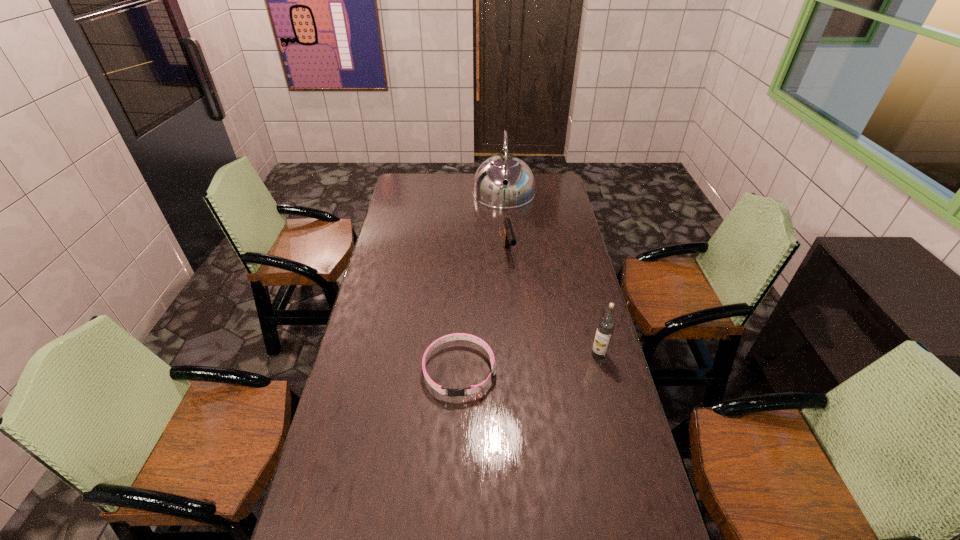
Where is `object located at the far right corner`? object located at the far right corner is located at coordinates (489, 189).

The height and width of the screenshot is (540, 960). In the image, there is a desktop. Find the location of `vacant space at the near edge`. vacant space at the near edge is located at coordinates (588, 512).

Where is `vacant area at the left edge`? Image resolution: width=960 pixels, height=540 pixels. vacant area at the left edge is located at coordinates (397, 333).

Locate an element on the screen. The height and width of the screenshot is (540, 960). free space at the right edge is located at coordinates (567, 254).

I want to click on free area in between the third shortest object and the kettle, so click(x=551, y=274).

Find the location of a particular element. The height and width of the screenshot is (540, 960). free area in between the second farthest object and the shortest object is located at coordinates (484, 312).

Where is `free space between the farthest object and the dog collar`? free space between the farthest object and the dog collar is located at coordinates (482, 282).

The height and width of the screenshot is (540, 960). Identify the location of vacant area that lies between the second shortest object and the dog collar. (484, 312).

I want to click on unoccupied area between the second farthest object and the shortest object, so click(484, 312).

Find the location of `empty space that is in between the pistol and the dog collar`. empty space that is in between the pistol and the dog collar is located at coordinates (484, 312).